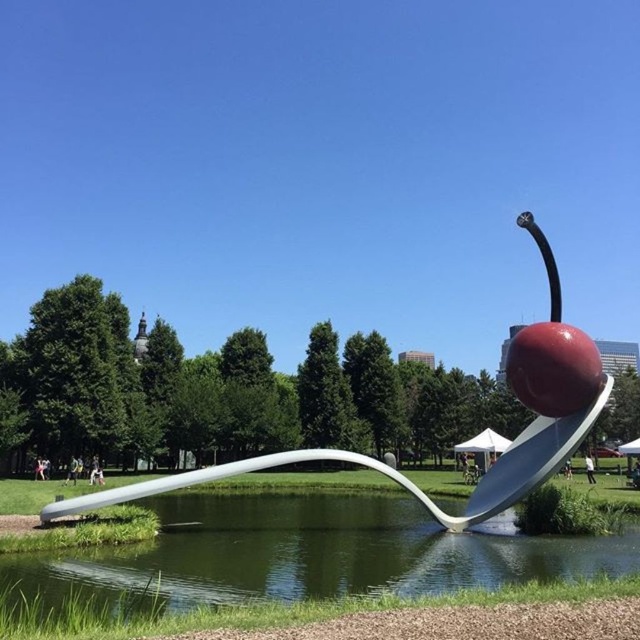
Question: Does clear water at spoon right appear on the right side of white glossy spoon at center?

Choices:
 (A) yes
 (B) no

Answer: (A)

Question: Does clear water at spoon right have a lesser width compared to white glossy spoon at center?

Choices:
 (A) no
 (B) yes

Answer: (B)

Question: Which point is closer to the camera?

Choices:
 (A) (508, 499)
 (B) (556, 572)

Answer: (B)

Question: Does clear water at spoon right have a larger size compared to white glossy spoon at center?

Choices:
 (A) no
 (B) yes

Answer: (A)

Question: Which object appears closest to the camera in this image?

Choices:
 (A) white glossy spoon at center
 (B) clear water at spoon right

Answer: (B)